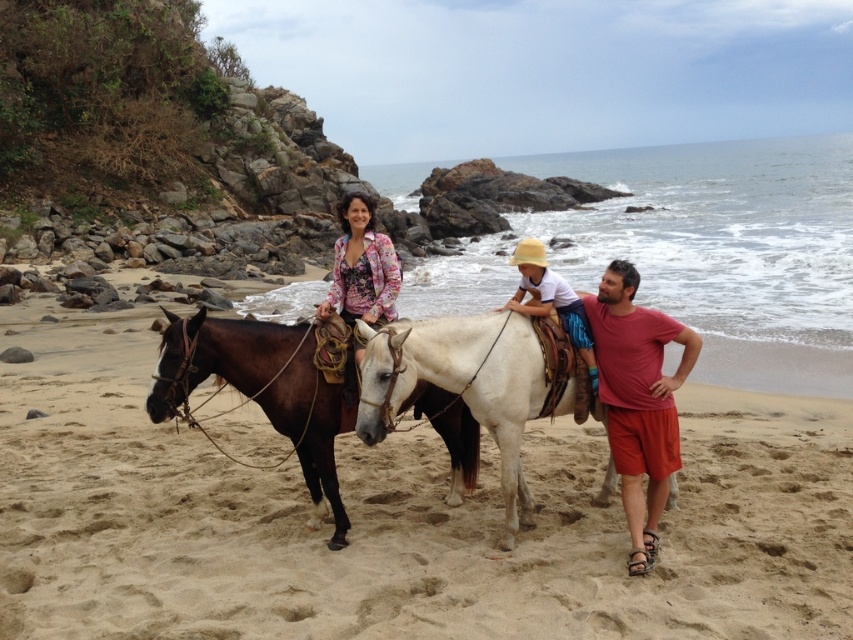
Is point (268, 428) in front of point (370, 305)?

No, it is behind (370, 305).

Does beige sandy beach at center have a lesser width compared to floral-patterned fabric at center?

No.

Who is more distant from viewer, (491, 588) or (344, 294)?

The point (344, 294) is behind.

At what (x,y) coordinates should I click in order to perform the action: click on beige sandy beach at center. Please return your answer as a coordinate pair (x, y). Image resolution: width=853 pixels, height=640 pixels. Looking at the image, I should click on (399, 522).

Who is more forward, (668, 410) or (358, 241)?

Point (668, 410)

You are a GUI agent. You are given a task and a screenshot of the screen. Output one action in this format:
    pyautogui.click(x=<x>, y=<y>)
    Task: Click on the matte red shorts at center
    This screenshot has height=640, width=853.
    Given the screenshot: What is the action you would take?
    pyautogui.click(x=637, y=400)

Does point (627, 394) come farther from viewer compared to point (376, 237)?

No, (627, 394) is in front of (376, 237).

You are a GUI agent. You are given a task and a screenshot of the screen. Output one action in this format:
    pyautogui.click(x=<x>, y=<y>)
    Task: Click on the matte red shorts at center
    
    Given the screenshot: What is the action you would take?
    pyautogui.click(x=637, y=400)

Can you confirm if shiny brown horse at center is thinner than floral-patterned fabric at center?

Incorrect, shiny brown horse at center's width is not less than floral-patterned fabric at center's.

From the picture: Who is shorter, shiny brown horse at center or floral-patterned fabric at center?

With less height is floral-patterned fabric at center.

Between point (502, 477) and point (363, 248), which one is positioned in front?

Point (502, 477) is more forward.

Find the location of a particular element. The image size is (853, 640). shiny brown horse at center is located at coordinates (469, 384).